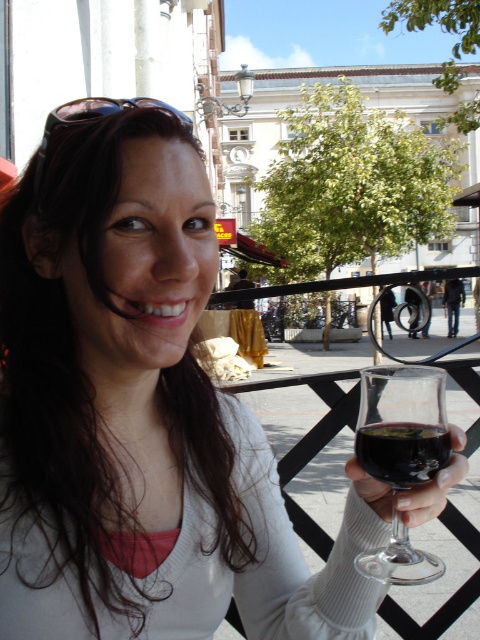
Question: Which of the following is the farthest from the observer?

Choices:
 (A) (384, 426)
 (B) (398, 564)

Answer: (B)

Question: Is transparent glass at lower right above dark red liquid at lower right?

Choices:
 (A) yes
 (B) no

Answer: (B)

Question: Can you confirm if transparent glass at lower right is smaller than dark red liquid at lower right?

Choices:
 (A) yes
 (B) no

Answer: (B)

Question: Which point is closer to the camera?

Choices:
 (A) transparent glass at lower right
 (B) dark red liquid at lower right

Answer: (B)

Question: Can you confirm if transparent glass at lower right is bigger than dark red liquid at lower right?

Choices:
 (A) yes
 (B) no

Answer: (A)